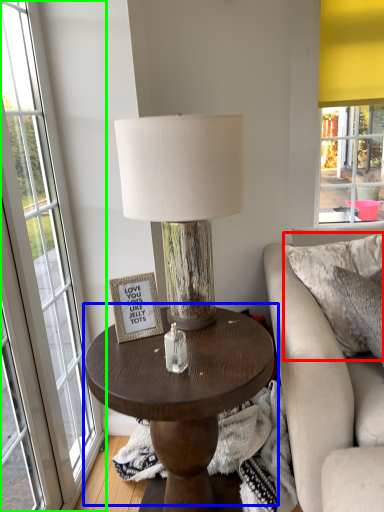
Question: Estimate the real-world distances between objects in this image. Which object is farther from pillow (highlighted by a red box), coffee table (highlighted by a blue box) or window (highlighted by a green box)?

Choices:
 (A) coffee table
 (B) window

Answer: (B)